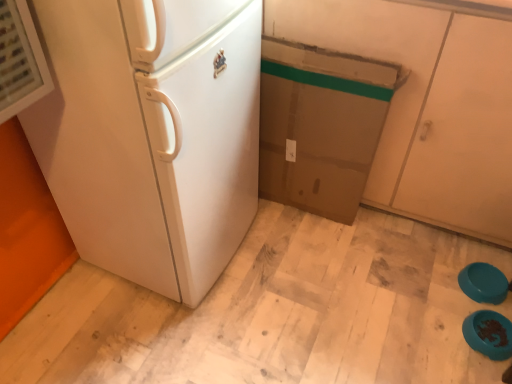
Question: Is matte brown cabinet at center wider than teal glossy bowls at lower right, the 2th appliance in the back-to-front sequence?

Choices:
 (A) yes
 (B) no

Answer: (A)

Question: From a real-world perspective, does matte brown cabinet at center sit lower than teal glossy bowls at lower right, the 2th appliance in the back-to-front sequence?

Choices:
 (A) no
 (B) yes

Answer: (A)

Question: Is matte brown cabinet at center positioned in front of teal glossy bowls at lower right, the 2th appliance in the back-to-front sequence?

Choices:
 (A) no
 (B) yes

Answer: (B)

Question: Is matte brown cabinet at center at the left side of teal glossy bowls at lower right, the 2th appliance in the back-to-front sequence?

Choices:
 (A) yes
 (B) no

Answer: (A)

Question: Is matte brown cabinet at center not within teal glossy bowls at lower right, the 2th appliance in the back-to-front sequence?

Choices:
 (A) yes
 (B) no

Answer: (A)

Question: Is teal glossy bowls at lower right, marked as the 1th appliance in a front-to-back arrangement, situated inside white matte refrigerator at left or outside?

Choices:
 (A) outside
 (B) inside

Answer: (A)

Question: Considering the positions of teal glossy bowls at lower right, the 2th appliance in the back-to-front sequence, and white matte refrigerator at left in the image, is teal glossy bowls at lower right, the 2th appliance in the back-to-front sequence, bigger or smaller than white matte refrigerator at left?

Choices:
 (A) big
 (B) small

Answer: (B)

Question: From the image's perspective, is teal glossy bowls at lower right, marked as the 1th appliance in a front-to-back arrangement, above or below white matte refrigerator at left?

Choices:
 (A) below
 (B) above

Answer: (A)

Question: In the image, is teal glossy bowls at lower right, marked as the 1th appliance in a front-to-back arrangement, positioned in front of or behind white matte refrigerator at left?

Choices:
 (A) front
 (B) behind

Answer: (B)

Question: Is teal plastic bowls at lower right, the 2th appliance viewed from the front, taller or shorter than white matte refrigerator at left?

Choices:
 (A) tall
 (B) short

Answer: (B)

Question: From a real-world perspective, relative to white matte refrigerator at left, is teal plastic bowls at lower right, the 2th appliance viewed from the front, vertically above or below?

Choices:
 (A) above
 (B) below

Answer: (B)

Question: Which is correct: teal plastic bowls at lower right, which appears as the 1th appliance when viewed from the back, is inside white matte refrigerator at left, or outside of it?

Choices:
 (A) outside
 (B) inside

Answer: (A)

Question: From the image's perspective, is teal plastic bowls at lower right, the 2th appliance viewed from the front, located above or below white matte refrigerator at left?

Choices:
 (A) above
 (B) below

Answer: (B)

Question: Considering the positions of point click(488, 271) and point click(495, 344), is point click(488, 271) closer or farther from the camera than point click(495, 344)?

Choices:
 (A) closer
 (B) farther

Answer: (B)

Question: Is teal plastic bowls at lower right, the 2th appliance viewed from the front, wider or thinner than teal glossy bowls at lower right, the 2th appliance in the back-to-front sequence?

Choices:
 (A) wide
 (B) thin

Answer: (B)